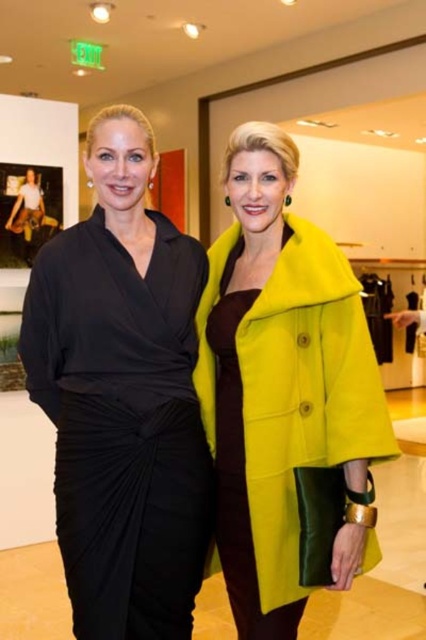
How much distance is there between matte black dress at left and vibrant yellow wool coat at center?

10.52 inches

Does point (66, 323) come in front of point (356, 420)?

No.

Is point (69, 536) farther from viewer compared to point (353, 333)?

That is False.

This screenshot has height=640, width=426. What are the coordinates of `matte black dress at left` in the screenshot? It's located at (123, 396).

Is matte black dress at left thinner than matte green coat at center?

In fact, matte black dress at left might be wider than matte green coat at center.

Is matte black dress at left above matte green coat at center?

Actually, matte black dress at left is below matte green coat at center.

Does point (135, 388) come in front of point (423, 324)?

Yes, point (135, 388) is closer to viewer.

Image resolution: width=426 pixels, height=640 pixels. Identify the location of matte black dress at left. (123, 396).

Who is lower down, vibrant yellow wool coat at center or matte green coat at center?

Positioned lower is vibrant yellow wool coat at center.

Find the location of a particular element. vibrant yellow wool coat at center is located at coordinates (304, 394).

At what (x,y) coordinates should I click in order to perform the action: click on vibrant yellow wool coat at center. Please return your answer as a coordinate pair (x, y). The image size is (426, 640). Looking at the image, I should click on (304, 394).